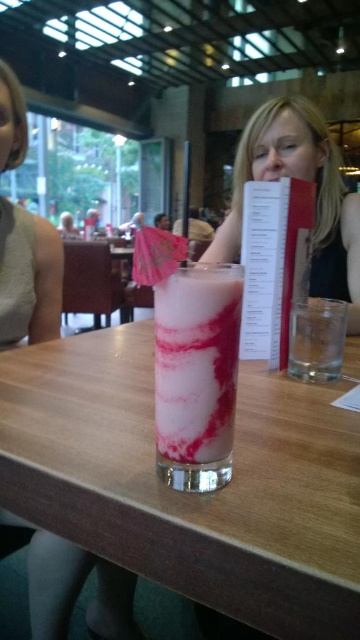
The height and width of the screenshot is (640, 360). I want to click on matte white dress at center, so click(77, 589).

Does matte white dress at center appear on the right side of smooth black hair at upper center?

Incorrect, matte white dress at center is not on the right side of smooth black hair at upper center.

What do you see at coordinates (77, 589) in the screenshot? The height and width of the screenshot is (640, 360). I see `matte white dress at center` at bounding box center [77, 589].

Find the location of `matte white dress at center`. matte white dress at center is located at coordinates (77, 589).

Who is positioned more to the left, swirled pink milkshake at center or white paper menu at center?

swirled pink milkshake at center is more to the left.

Between point (201, 413) and point (276, 314), which one is positioned in front?

Point (201, 413)

Measure the distance between swirled pink milkshake at center and camera.

swirled pink milkshake at center and camera are 13.26 inches apart from each other.

Where is `swirled pink milkshake at center`? Image resolution: width=360 pixels, height=640 pixels. swirled pink milkshake at center is located at coordinates (196, 362).

Is swirled pink milkshake at center bigger than smooth black hair at upper center?

No, swirled pink milkshake at center is not bigger than smooth black hair at upper center.

This screenshot has height=640, width=360. What do you see at coordinates (196, 362) in the screenshot?
I see `swirled pink milkshake at center` at bounding box center [196, 362].

Where is `swirled pink milkshake at center`? swirled pink milkshake at center is located at coordinates (196, 362).